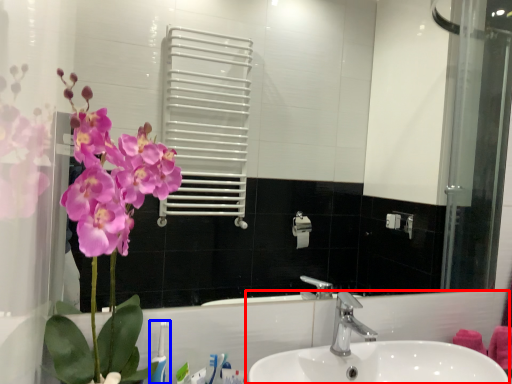
Question: Which point is further to the camera, sink (highlighted by a red box) or toothbrush (highlighted by a blue box)?

Choices:
 (A) sink
 (B) toothbrush

Answer: (B)